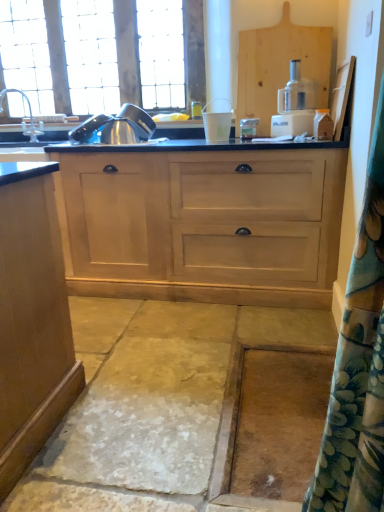
Question: From the image's perspective, is light wood cabinet at center located beneath smooth stone concrete at center?

Choices:
 (A) yes
 (B) no

Answer: (B)

Question: Is light wood cabinet at center to the left of smooth stone concrete at center from the viewer's perspective?

Choices:
 (A) yes
 (B) no

Answer: (A)

Question: Considering the relative sizes of light wood cabinet at center and smooth stone concrete at center in the image provided, is light wood cabinet at center smaller than smooth stone concrete at center?

Choices:
 (A) yes
 (B) no

Answer: (B)

Question: Is smooth stone concrete at center at the back of light wood cabinet at center?

Choices:
 (A) no
 (B) yes

Answer: (A)

Question: Is the surface of light wood cabinet at center in direct contact with smooth stone concrete at center?

Choices:
 (A) yes
 (B) no

Answer: (B)

Question: From a real-world perspective, is light wood cabinet at center located beneath smooth stone concrete at center?

Choices:
 (A) no
 (B) yes

Answer: (A)

Question: Is silver metallic faucet at left completely or partially inside white plastic food processor at center?

Choices:
 (A) yes
 (B) no

Answer: (B)

Question: From the image's perspective, is white plastic food processor at center located beneath silver metallic faucet at left?

Choices:
 (A) no
 (B) yes

Answer: (B)

Question: Considering the relative positions of white plastic food processor at center and silver metallic faucet at left in the image provided, is white plastic food processor at center to the right of silver metallic faucet at left from the viewer's perspective?

Choices:
 (A) yes
 (B) no

Answer: (A)

Question: From the image's perspective, is white plastic food processor at center on silver metallic faucet at left?

Choices:
 (A) no
 (B) yes

Answer: (A)

Question: From a real-world perspective, is white plastic food processor at center on silver metallic faucet at left?

Choices:
 (A) yes
 (B) no

Answer: (A)

Question: Is white plastic food processor at center thinner than silver metallic faucet at left?

Choices:
 (A) yes
 (B) no

Answer: (B)

Question: Is white plastic cup at center, placed as the second appliance when sorted from left to right, facing away from stainless steel kettle at upper left, which is the second appliance from right to left?

Choices:
 (A) yes
 (B) no

Answer: (B)